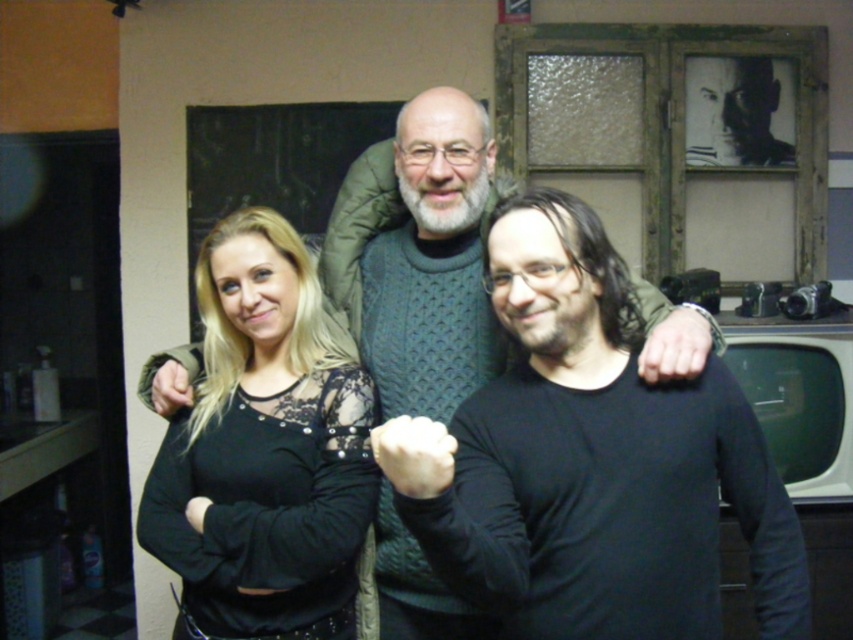
Question: Is black matte shirt at center bigger than black lace top at center?

Choices:
 (A) yes
 (B) no

Answer: (A)

Question: Is black matte shirt at center closer to the viewer compared to knitted sweater at center?

Choices:
 (A) no
 (B) yes

Answer: (B)

Question: Is black matte shirt at center positioned in front of knitted sweater at center?

Choices:
 (A) yes
 (B) no

Answer: (A)

Question: Which point is farther to the camera?

Choices:
 (A) (714, 536)
 (B) (241, 412)
 (C) (386, 568)

Answer: (C)

Question: Which point is farther to the camera?

Choices:
 (A) (296, 605)
 (B) (413, 488)

Answer: (A)

Question: Which object is the farthest from the black lace top at center?

Choices:
 (A) knitted sweater at center
 (B) black matte shirt at center

Answer: (B)